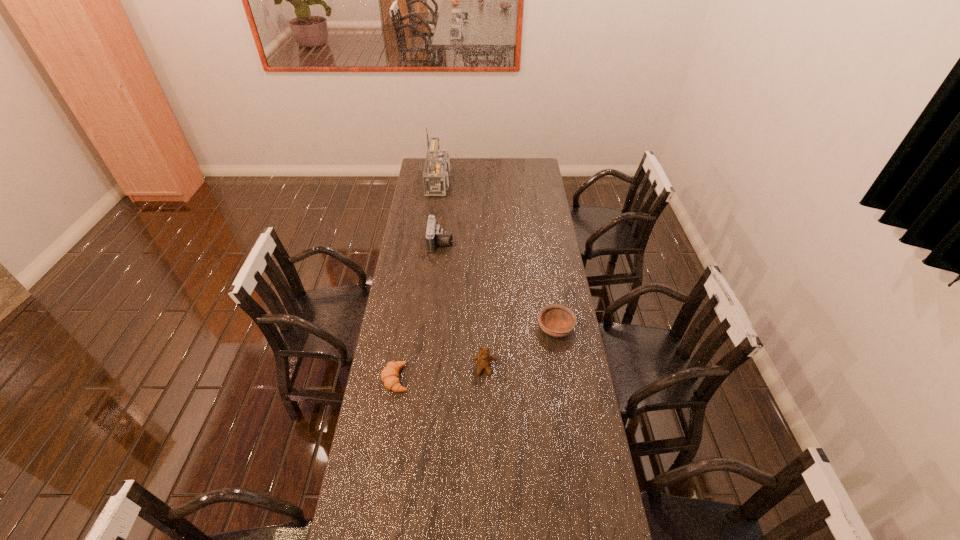
You are a GUI agent. You are given a task and a screenshot of the screen. Output one action in this format:
    pyautogui.click(x=<x>, y=<y>)
    Task: Click on the vacant region at the right edge of the desktop
    
    Given the screenshot: What is the action you would take?
    pyautogui.click(x=530, y=190)

This screenshot has width=960, height=540. I want to click on vacant space at the far left corner of the desktop, so click(x=421, y=167).

Find the location of `free spot between the third farthest object and the crescent roll`. free spot between the third farthest object and the crescent roll is located at coordinates (476, 353).

Identify the location of free space between the farthest object and the bowl. This screenshot has height=540, width=960. (499, 255).

The image size is (960, 540). In order to click on free spot between the second object from right to left and the crescent roll in this screenshot , I will do `click(440, 374)`.

Where is `unoccupied position between the shortest object and the teddy bear`? The height and width of the screenshot is (540, 960). unoccupied position between the shortest object and the teddy bear is located at coordinates tap(440, 374).

Identify the location of empty space that is in between the teddy bear and the crescent roll. (440, 374).

In order to click on free space between the teddy bear and the rightmost object in this screenshot , I will do `click(520, 348)`.

Select which object appears as the second closest to the farthest object. Please provide its 2D coordinates. Your answer should be formatted as a tuple, i.e. [(x, y)], where the tuple contains the x and y coordinates of a point satisfying the conditions above.

[(556, 320)]

Locate which object is the second closest to the radio receiver. Please provide its 2D coordinates. Your answer should be formatted as a tuple, i.e. [(x, y)], where the tuple contains the x and y coordinates of a point satisfying the conditions above.

[(556, 320)]